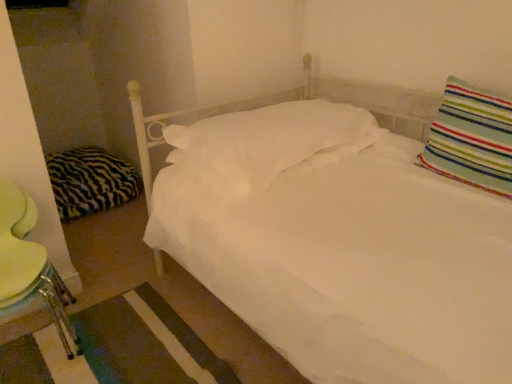
What are the coordinates of `unoccupied region to the right of metallic green swivel chair at lower left` in the screenshot? It's located at (129, 333).